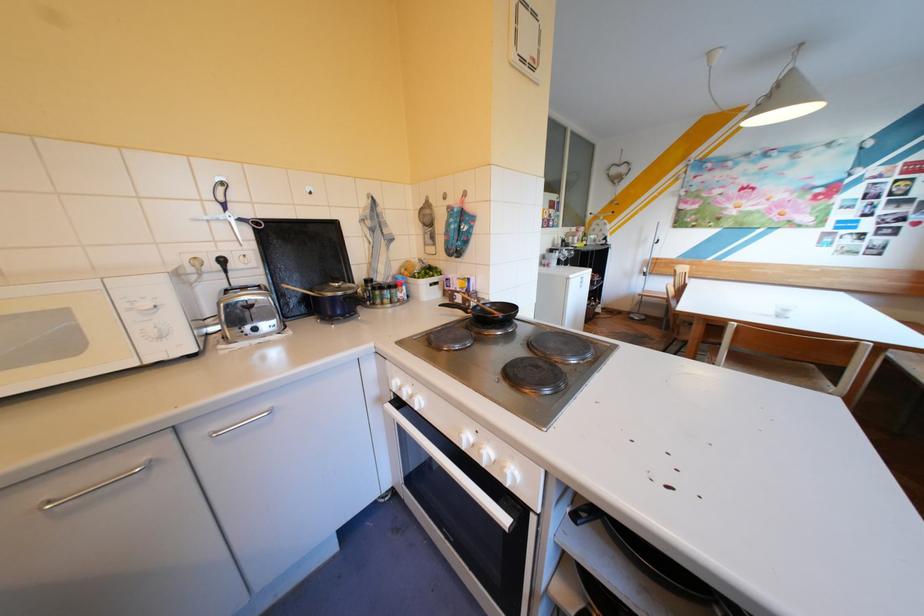
Describe the element at coordinates (471, 488) in the screenshot. I see `the white oven handle` at that location.